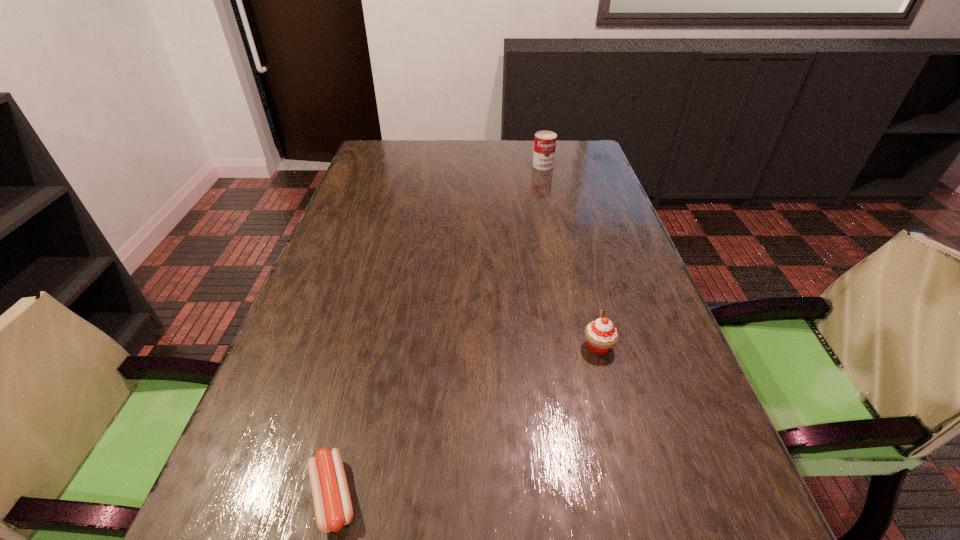
Where is `object present at the left edge`? The width and height of the screenshot is (960, 540). object present at the left edge is located at coordinates (x=333, y=508).

Identify the location of can present at the right edge. click(x=545, y=141).

At what (x,y) coordinates should I click in order to perform the action: click on cupcake positioned at the right edge. Please return your answer as a coordinate pair (x, y). The height and width of the screenshot is (540, 960). Looking at the image, I should click on (601, 335).

Where is `object present at the far right corner`? object present at the far right corner is located at coordinates (545, 141).

The image size is (960, 540). In the image, there is a desktop. What are the coordinates of `vacant region at the far edge` in the screenshot? It's located at (446, 156).

You are a GUI agent. You are given a task and a screenshot of the screen. Output one action in this format:
    pyautogui.click(x=<x>, y=<y>)
    Task: Click on the vacant space at the left edge of the desktop
    
    Given the screenshot: What is the action you would take?
    pyautogui.click(x=366, y=180)

Identify the location of free location at the right edge. (666, 355).

Find the location of a particular element. The height and width of the screenshot is (540, 960). free space between the sausage and the can is located at coordinates 438,330.

Find the location of `unoccupied area between the sausage and the tallest object`. unoccupied area between the sausage and the tallest object is located at coordinates (438, 330).

Identify the location of free spot between the leftmost object and the cupcake. The height and width of the screenshot is (540, 960). (466, 421).